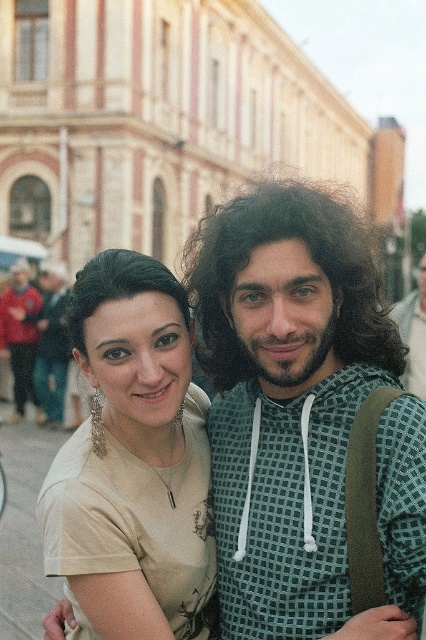
You are a photographer trying to capture a group photo of the curly brown hair at center and the red jacket at left. Based on their sizes, which one should you position closer to the camera to ensure both appear equally sized in the photo?

Since the curly brown hair at center might be wider than the red jacket at left, you should position the red jacket at left closer to the camera to balance their sizes in the photo.

You are an AI analyzing the positioning of objects in an image. The scene shows two people standing outdoors near a classical building. You need to determine the exact coordinates of the matte beige shirt at center. What are its coordinates?

The coordinates of the matte beige shirt at center are at point (287,394).

Please use the coordinates provided to identify the feature located at point (311, 259) in the image. What is the feature at this coordinate?

The feature at point (311, 259) is curly brown hair at center.